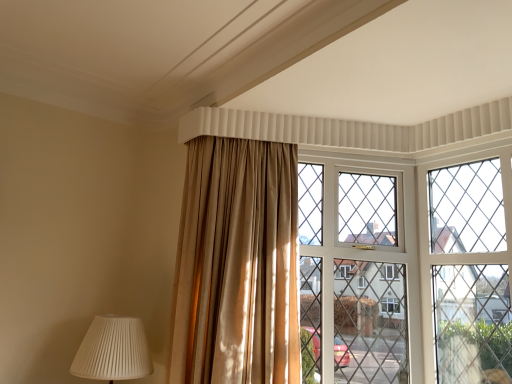
Describe the element at coordinates (113, 350) in the screenshot. I see `white pleated lampshade at lower left` at that location.

Identify the location of satin gold curtain at center. (236, 265).

From the picture: Does clear glass window at center appear on the left side of satin gold curtain at center?

Incorrect, clear glass window at center is not on the left side of satin gold curtain at center.

What's the angular difference between clear glass window at center and satin gold curtain at center's facing directions?

There is a 1.23-degree angle between the facing directions of clear glass window at center and satin gold curtain at center.

Can you confirm if clear glass window at center is smaller than satin gold curtain at center?

Indeed, clear glass window at center has a smaller size compared to satin gold curtain at center.

Which object is positioned more to the left, white pleated lampshade at lower left or clear glass window at center?

From the viewer's perspective, white pleated lampshade at lower left appears more on the left side.

Is white pleated lampshade at lower left in front of or behind clear glass window at center in the image?

white pleated lampshade at lower left is positioned closer to the viewer than clear glass window at center.

Can you confirm if white pleated lampshade at lower left is smaller than clear glass window at center?

Correct, white pleated lampshade at lower left occupies less space than clear glass window at center.

Measure the distance from white pleated lampshade at lower left to clear glass window at center.

A distance of 4.40 feet exists between white pleated lampshade at lower left and clear glass window at center.

From the image's perspective, is satin gold curtain at center above or below clear glass window at center?

satin gold curtain at center is above clear glass window at center.

Consider the image. Which object is further away from the camera taking this photo, satin gold curtain at center or clear glass window at center?

clear glass window at center.

Is clear glass window at center inside satin gold curtain at center?

No, clear glass window at center is located outside of satin gold curtain at center.

Are satin gold curtain at center and clear glass window at center located far from each other?

That's not correct — satin gold curtain at center is a little close to clear glass window at center.

Can you see satin gold curtain at center touching white pleated lampshade at lower left?

satin gold curtain at center and white pleated lampshade at lower left are not in contact.

Locate an element on the screen. table lamp that appears below the satin gold curtain at center (from the image's perspective) is located at coordinates (113, 350).

Consider the image. Considering the positions of objects satin gold curtain at center and white pleated lampshade at lower left in the image provided, who is more to the right, satin gold curtain at center or white pleated lampshade at lower left?

satin gold curtain at center is more to the right.

Between white pleated lampshade at lower left and satin gold curtain at center, which one appears on the right side from the viewer's perspective?

→ satin gold curtain at center.

Is white pleated lampshade at lower left next to satin gold curtain at center and touching it?

There is a gap between white pleated lampshade at lower left and satin gold curtain at center.

From the image's perspective, which is below, white pleated lampshade at lower left or satin gold curtain at center?

white pleated lampshade at lower left, from the image's perspective.

Does white pleated lampshade at lower left lie in front of satin gold curtain at center?

No, white pleated lampshade at lower left is further to the viewer.

Would you say clear glass window at center is a long distance from white pleated lampshade at lower left?

That's right, there is a large distance between clear glass window at center and white pleated lampshade at lower left.

Looking at this image, from the image's perspective, does clear glass window at center appear higher than white pleated lampshade at lower left?

Indeed, from the image's perspective, clear glass window at center is shown above white pleated lampshade at lower left.

From a real-world perspective, is clear glass window at center physically located above or below white pleated lampshade at lower left?

Clearly, from a real-world perspective, clear glass window at center is above white pleated lampshade at lower left.

Is clear glass window at center oriented away from white pleated lampshade at lower left?

clear glass window at center is not turned away from white pleated lampshade at lower left.

At what (x,y) coordinates should I click in order to perform the action: click on window above the satin gold curtain at center (from a real-world perspective). Please return your answer as a coordinate pair (x, y). This screenshot has width=512, height=384. Looking at the image, I should click on (409, 267).

This screenshot has width=512, height=384. I want to click on table lamp located underneath the clear glass window at center (from a real-world perspective), so click(113, 350).

When comparing their distances from satin gold curtain at center, does white pleated lampshade at lower left or clear glass window at center seem further?

Among the two, clear glass window at center is located further to satin gold curtain at center.

Looking at this image, which object lies further to the anchor point clear glass window at center, satin gold curtain at center or white pleated lampshade at lower left?

white pleated lampshade at lower left lies further to clear glass window at center than the other object.

Based on the photo, considering their positions, is satin gold curtain at center positioned closer to white pleated lampshade at lower left than clear glass window at center?

satin gold curtain at center is closer to white pleated lampshade at lower left.

Looking at the image, which one is located closer to clear glass window at center, white pleated lampshade at lower left or satin gold curtain at center?

satin gold curtain at center lies closer to clear glass window at center than the other object.

Based on their spatial positions, is clear glass window at center or satin gold curtain at center closer to white pleated lampshade at lower left?

Based on the image, satin gold curtain at center appears to be nearer to white pleated lampshade at lower left.

Estimate the real-world distances between objects in this image. Which object is further from satin gold curtain at center, clear glass window at center or white pleated lampshade at lower left?

clear glass window at center is positioned further to the anchor satin gold curtain at center.

At what (x,y) coordinates should I click in order to perform the action: click on curtain between white pleated lampshade at lower left and clear glass window at center. Please return your answer as a coordinate pair (x, y). Looking at the image, I should click on (236, 265).